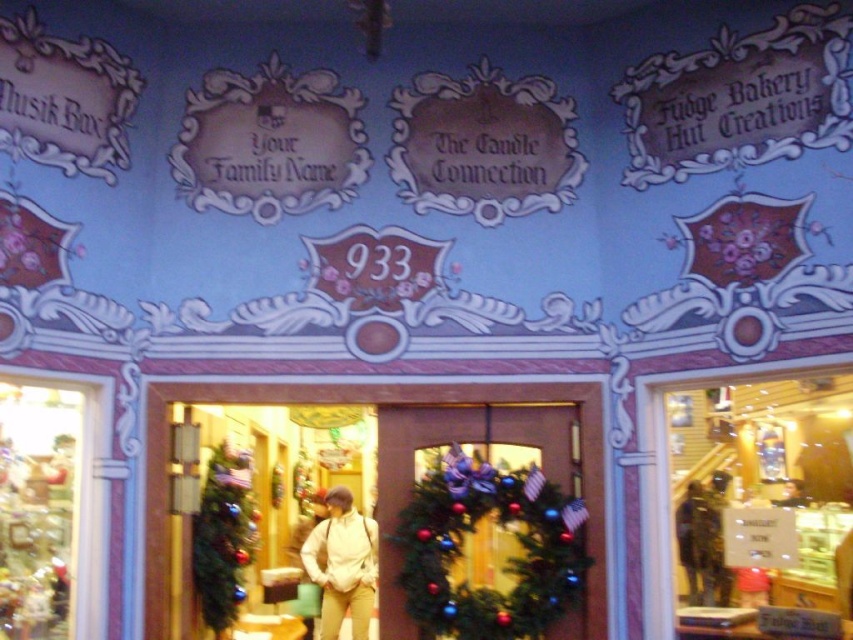
Who is lower down, green matte christmas tree at lower left or white matte jacket at center?

white matte jacket at center

Is green matte christmas tree at lower left smaller than white matte jacket at center?

Indeed, green matte christmas tree at lower left has a smaller size compared to white matte jacket at center.

This screenshot has height=640, width=853. What do you see at coordinates (223, 538) in the screenshot?
I see `green matte christmas tree at lower left` at bounding box center [223, 538].

Where is `green matte christmas tree at lower left`? green matte christmas tree at lower left is located at coordinates (223, 538).

Who is positioned more to the left, translucent glass ornaments at left or white matte jacket at center?

translucent glass ornaments at left

Can you confirm if translucent glass ornaments at left is positioned to the right of white matte jacket at center?

In fact, translucent glass ornaments at left is to the left of white matte jacket at center.

Is point (62, 573) less distant than point (351, 589)?

Yes.

Identify the location of translucent glass ornaments at left. Image resolution: width=853 pixels, height=640 pixels. (50, 509).

Could you measure the distance between translucent glass ornaments at left and green matte christmas tree at lower left?

The distance of translucent glass ornaments at left from green matte christmas tree at lower left is 78.68 centimeters.

Who is shorter, translucent glass ornaments at left or green matte christmas tree at lower left?

Standing shorter between the two is green matte christmas tree at lower left.

Which is in front, point (39, 410) or point (230, 572)?

Point (39, 410) is more forward.

You are a GUI agent. You are given a task and a screenshot of the screen. Output one action in this format:
    pyautogui.click(x=<x>, y=<y>)
    Task: Click on the translucent glass ornaments at left
    
    Given the screenshot: What is the action you would take?
    pos(50,509)